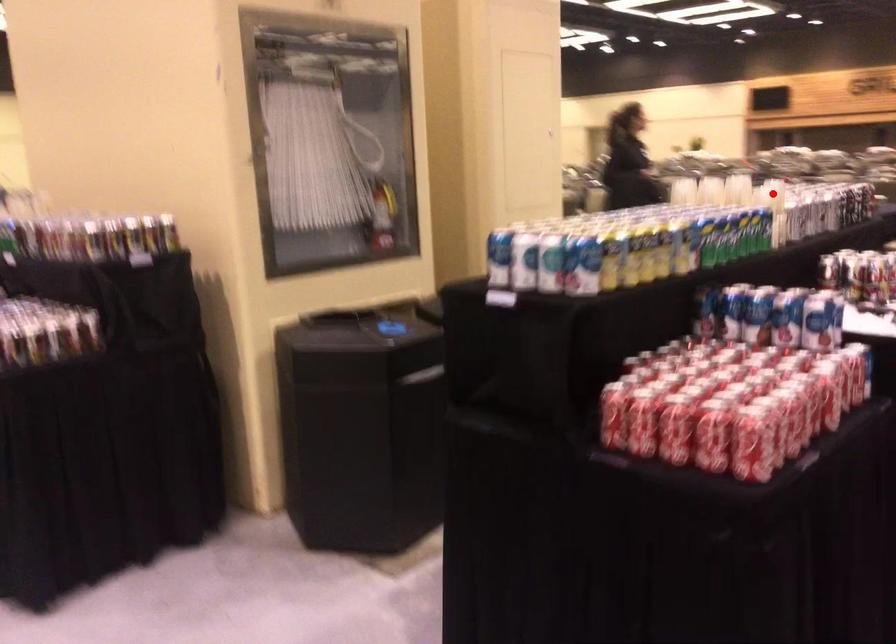
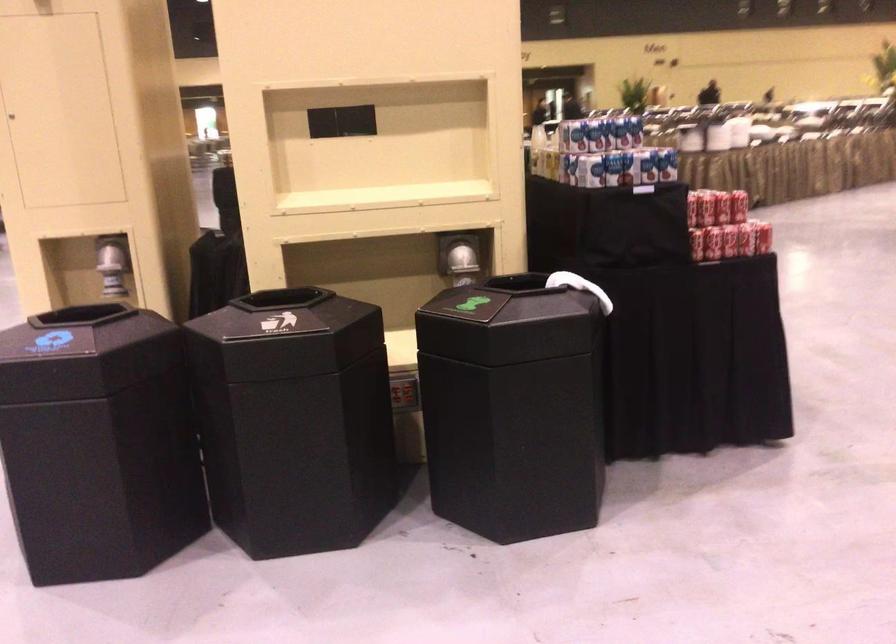
Question: I am providing you with two images of the same scene from different viewpoints. A red point is marked on the first image. At the location where the point appears in image 1, is it still visible in image 2?

Choices:
 (A) Yes
 (B) No

Answer: (B)